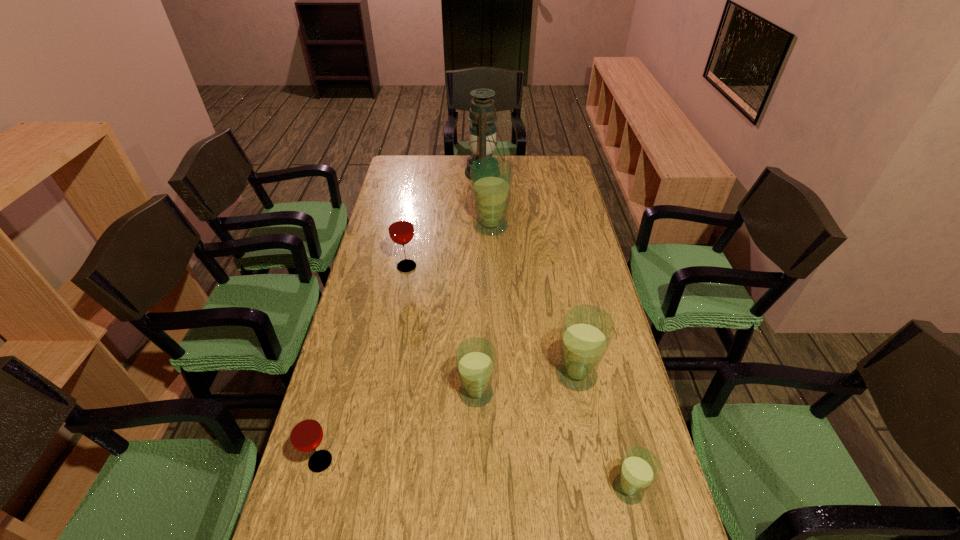
Identify the location of object that ranks as the third closest to the leftmost glass. (401, 230).

Point out which object is positioned as the fifth nearest to the third smallest blue glass. Please provide its 2D coordinates. Your answer should be formatted as a tuple, i.e. [(x, y)], where the tuple contains the x and y coordinates of a point satisfying the conditions above.

[(305, 432)]

Find the location of a particular element. Image resolution: width=960 pixels, height=540 pixels. the fifth closest glass to the smaller red glass is located at coordinates (491, 177).

Find the location of a particular element. The height and width of the screenshot is (540, 960). the fifth closest glass relative to the smallest blue glass is located at coordinates (491, 177).

Identify which blue glass is located as the third nearest to the leftmost glass. Please provide its 2D coordinates. Your answer should be formatted as a tuple, i.e. [(x, y)], where the tuple contains the x and y coordinates of a point satisfying the conditions above.

[(640, 468)]

Identify which blue glass is the second nearest to the oil lamp. Please provide its 2D coordinates. Your answer should be formatted as a tuple, i.e. [(x, y)], where the tuple contains the x and y coordinates of a point satisfying the conditions above.

[(587, 330)]

Select which red glass appears as the second closest to the shortest object. Please provide its 2D coordinates. Your answer should be formatted as a tuple, i.e. [(x, y)], where the tuple contains the x and y coordinates of a point satisfying the conditions above.

[(401, 230)]

You are a GUI agent. You are given a task and a screenshot of the screen. Output one action in this format:
    pyautogui.click(x=<x>, y=<y>)
    Task: Click on the red glass that stands as the second closest to the second biggest blue glass
    The image size is (960, 540).
    Given the screenshot: What is the action you would take?
    pyautogui.click(x=305, y=432)

The height and width of the screenshot is (540, 960). In order to click on vacant position in the image that satisfies the following two spatial constraints: 1. on the back side of the tallest glass; 2. on the right side of the nearer red glass in this screenshot , I will do `click(383, 226)`.